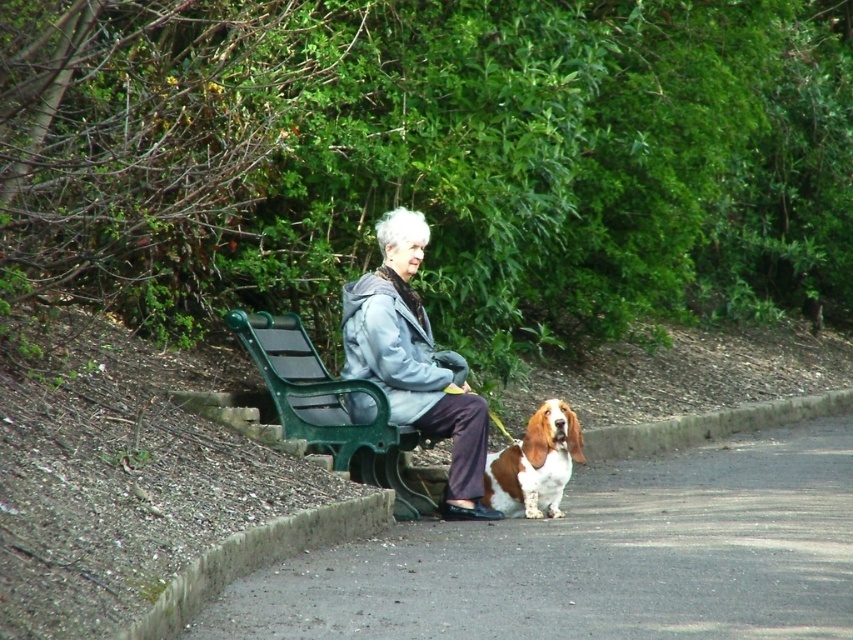
You are a delivery robot navigating through a park. You need to reach a delivery point located beyond the smooth asphalt road at lower center. There is a brown and white fur at lower center in your path. Can you pass through the area where both objects are located?

The smooth asphalt road at lower center is smaller than brown and white fur at lower center, so the brown and white fur at lower center is larger and may block the path. The robot should find an alternative route around the brown and white fur at lower center to reach the delivery point.

You are a pedestrian standing at the edge of the smooth asphalt road at lower center. You want to reach the gray fleece jacket at center. Can you step onto the road to get there?

The smooth asphalt road at lower center is not as tall as gray fleece jacket at center, so yes, you can step onto the road to reach the gray fleece jacket at center since the road is lower than the jacket.

You are a tailor who needs to determine which item is smaller in size between the gray fleece jacket at center and the green plastic bench at center. Based on the scene, which one is smaller?

The gray fleece jacket at center has a smaller size compared to the green plastic bench at center, so the gray fleece jacket at center is smaller.